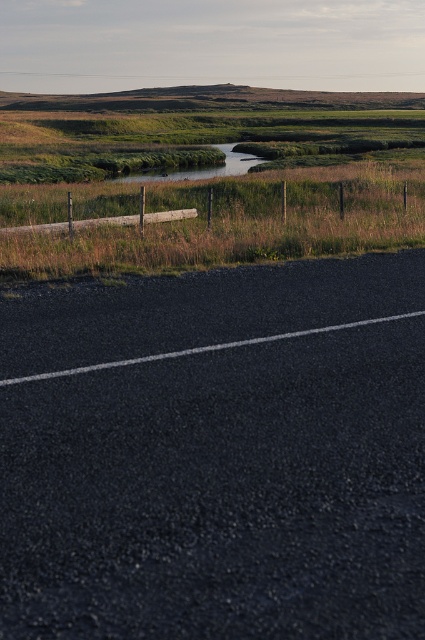
Is black asphalt highway at lower center further to camera compared to green grass at upper center?

No.

Where is `black asphalt highway at lower center`? The width and height of the screenshot is (425, 640). black asphalt highway at lower center is located at coordinates (221, 493).

Who is more distant from viewer, (x=362, y=561) or (x=258, y=243)?

The point (x=258, y=243) is behind.

The image size is (425, 640). I want to click on black asphalt highway at lower center, so click(221, 493).

Looking at this image, can you confirm if black asphalt highway at lower center is thinner than green grassy creek at center?

Yes.

Consider the image. Is black asphalt highway at lower center above green grassy creek at center?

Incorrect, black asphalt highway at lower center is not positioned above green grassy creek at center.

Between point (271, 625) and point (218, 144), which one is positioned behind?

Point (218, 144)

I want to click on black asphalt highway at lower center, so click(221, 493).

Which of these two, green grass at upper center or green grassy creek at center, stands shorter?

green grassy creek at center is shorter.

Does point (422, 160) lie in front of point (130, 172)?

That is True.

Is point (411, 154) closer to camera compared to point (133, 176)?

No, it is behind (133, 176).

You are a GUI agent. You are given a task and a screenshot of the screen. Output one action in this format:
    pyautogui.click(x=<x>, y=<y>)
    Task: Click on the green grass at upper center
    
    Given the screenshot: What is the action you would take?
    pyautogui.click(x=207, y=177)